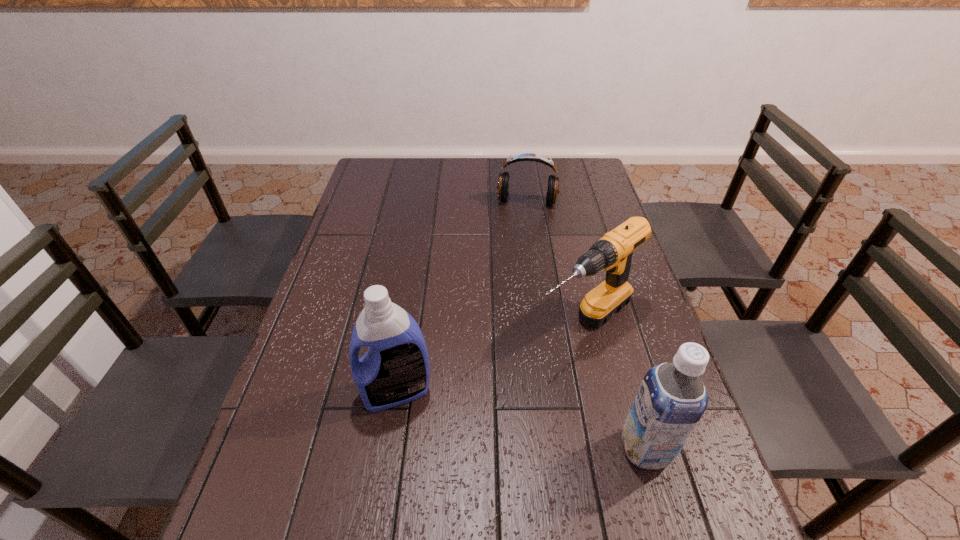
Identify the location of the leftmost object. The width and height of the screenshot is (960, 540). (395, 370).

The image size is (960, 540). What are the coordinates of `the third farthest object` in the screenshot? It's located at (395, 370).

In order to click on the nearest object in this screenshot , I will do `click(671, 400)`.

This screenshot has width=960, height=540. I want to click on the third nearest object, so click(x=613, y=252).

You are a GUI agent. You are given a task and a screenshot of the screen. Output one action in this format:
    pyautogui.click(x=<x>, y=<y>)
    Task: Click on the shortest object
    This screenshot has width=960, height=540.
    Given the screenshot: What is the action you would take?
    503,181

Locate an element on the screen. headset is located at coordinates (503, 181).

This screenshot has height=540, width=960. What are the coordinates of `free space located 0.130m on the front of the detergent` in the screenshot? It's located at (384, 475).

You are a GUI agent. You are given a task and a screenshot of the screen. Output one action in this format:
    pyautogui.click(x=<x>, y=<y>)
    Task: Click on the vacant space located 0.070m on the label of the soya milk
    This screenshot has width=960, height=540.
    Given the screenshot: What is the action you would take?
    click(x=703, y=449)

Locate an element on the screen. This screenshot has height=540, width=960. free space located at the tip of the second farthest object is located at coordinates (482, 405).

At what (x,y) coordinates should I click in order to perform the action: click on free space located 0.270m at the tip of the second farthest object. Please return your answer as a coordinate pair (x, y). Image resolution: width=960 pixels, height=540 pixels. Looking at the image, I should click on (464, 419).